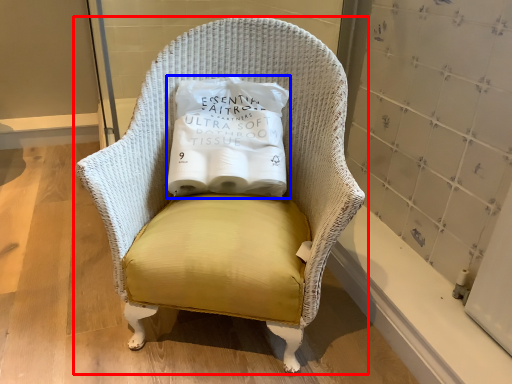
Question: Which object is closer to the camera taking this photo, chair (highlighted by a red box) or pillow (highlighted by a blue box)?

Choices:
 (A) chair
 (B) pillow

Answer: (A)